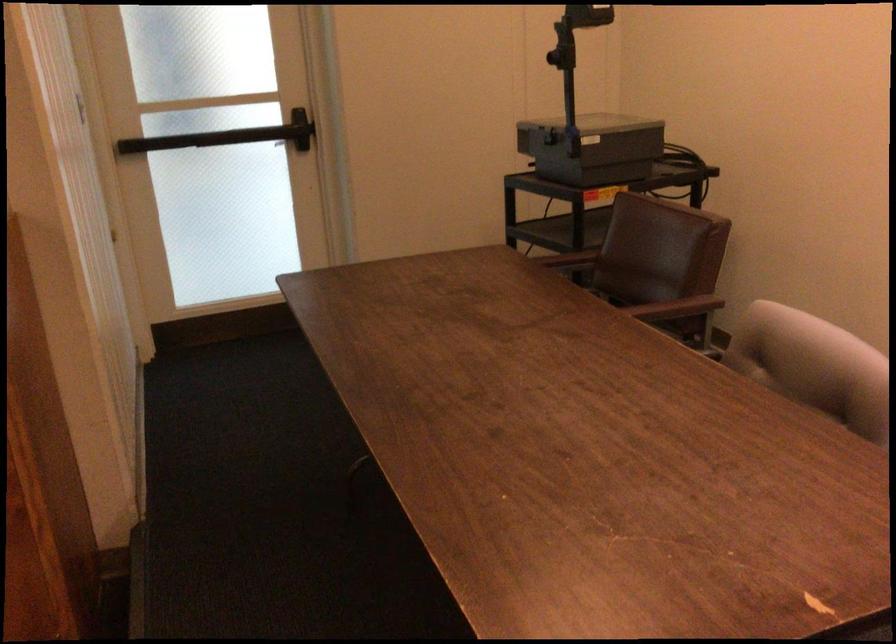
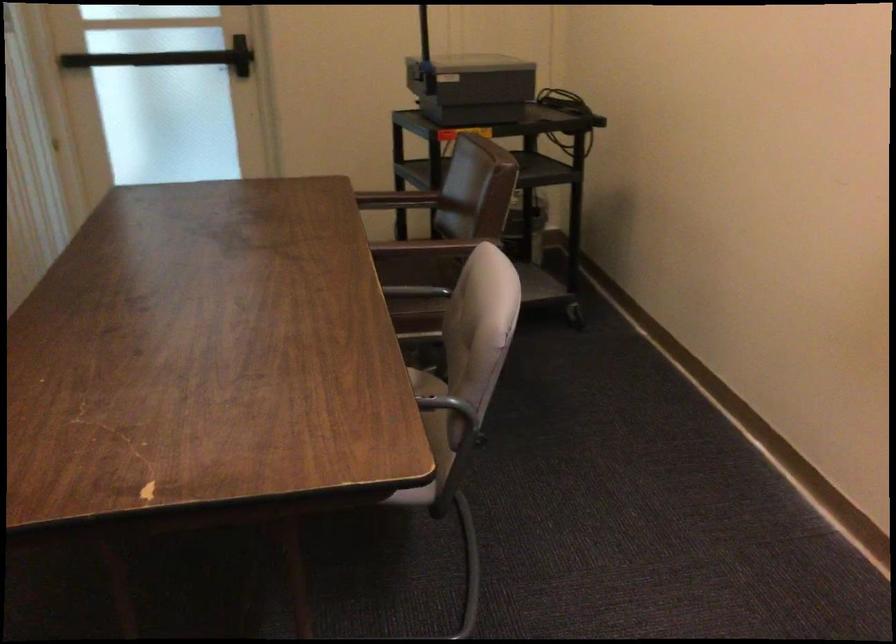
Question: Which direction would the cameraman need to move to produce the second image? Reply with the corresponding letter.

Choices:
 (A) Left
 (B) Right
 (C) Forward
 (D) Backward

Answer: (B)